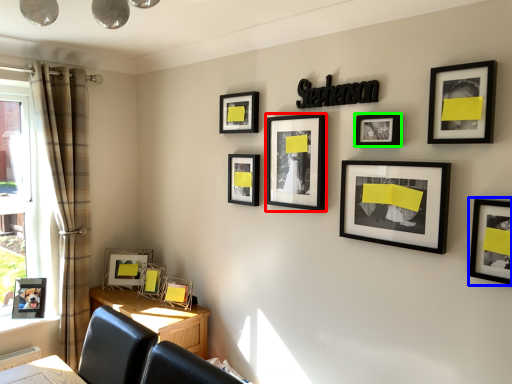
Question: Which object is positioned closest to picture frame (highlighted by a red box)? Select from picture frame (highlighted by a blue box) and picture frame (highlighted by a green box).

Choices:
 (A) picture frame
 (B) picture frame

Answer: (B)